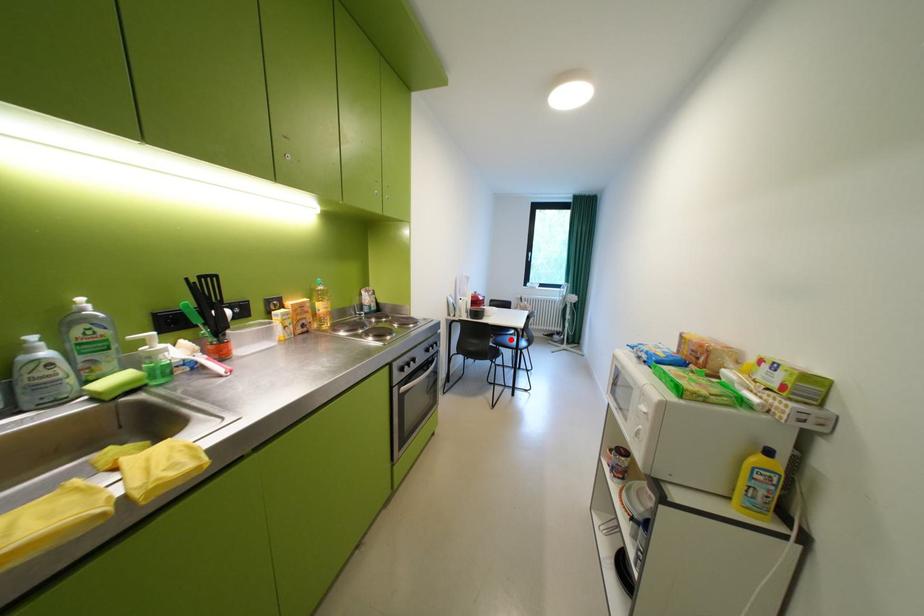
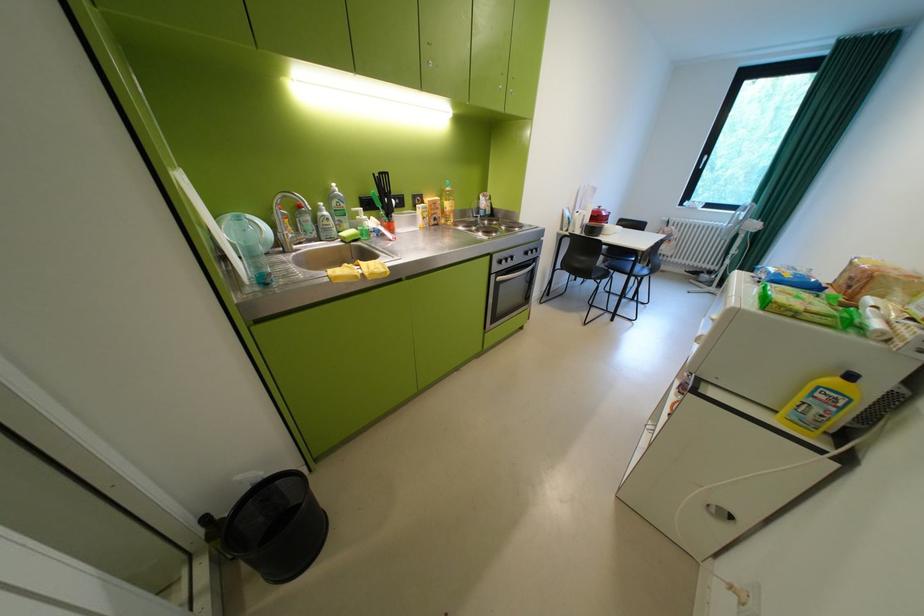
Question: I am providing you with two images of the same scene from different viewpoints. A red point is marked on the first image. Can you still see the location of the red point in image 2?

Choices:
 (A) Yes
 (B) No

Answer: (A)